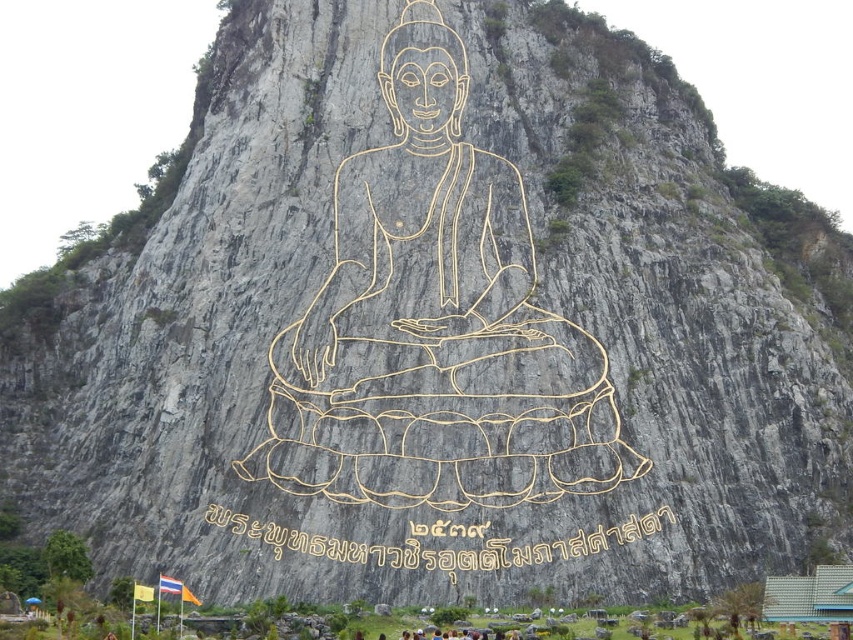
Is gold wire buddha at center to the right of yellow gold text at center from the viewer's perspective?

No, gold wire buddha at center is not to the right of yellow gold text at center.

The height and width of the screenshot is (640, 853). Describe the element at coordinates (434, 324) in the screenshot. I see `gold wire buddha at center` at that location.

Between point (334, 429) and point (503, 545), which one is positioned in front?

Point (503, 545)

This screenshot has width=853, height=640. Identify the location of gold wire buddha at center. pyautogui.click(x=434, y=324).